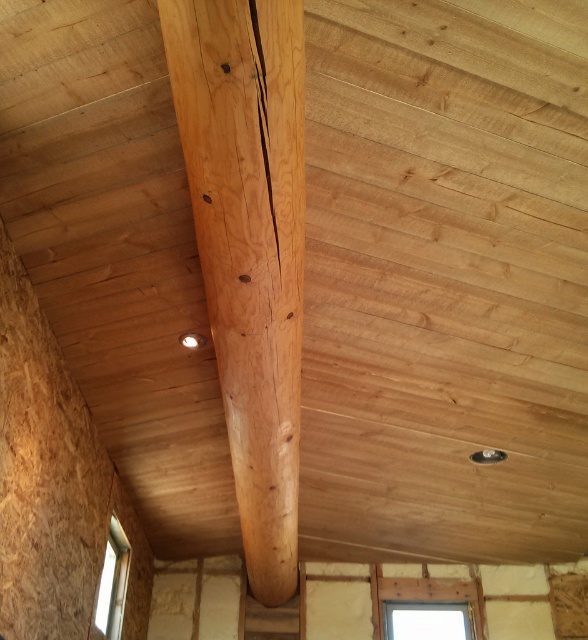
Looking at this image, between clear glass window at center and clear glass window at lower left, which one has more height?

clear glass window at lower left is taller.

Does clear glass window at center have a smaller size compared to clear glass window at lower left?

Yes, clear glass window at center is smaller than clear glass window at lower left.

Is point (443, 618) in front of point (101, 604)?

No, it is behind (101, 604).

The height and width of the screenshot is (640, 588). Find the location of `clear glass window at center`. clear glass window at center is located at coordinates (426, 620).

Which is above, natural wood beam at center or clear glass window at center?

natural wood beam at center is higher up.

Based on the photo, who is lower down, natural wood beam at center or clear glass window at center?

Positioned lower is clear glass window at center.

Based on the photo, who is more forward, (230, 65) or (409, 605)?

Point (230, 65)

Identify the location of natural wood beam at center. (249, 244).

Can you confirm if natural wood beam at center is shorter than clear glass window at lower left?

No, natural wood beam at center is not shorter than clear glass window at lower left.

How much distance is there between natural wood beam at center and clear glass window at lower left?

natural wood beam at center is 1.22 meters from clear glass window at lower left.

Which is behind, point (286, 22) or point (122, 577)?

The point (122, 577) is more distant.

Where is `natural wood beam at center`? Image resolution: width=588 pixels, height=640 pixels. natural wood beam at center is located at coordinates (249, 244).